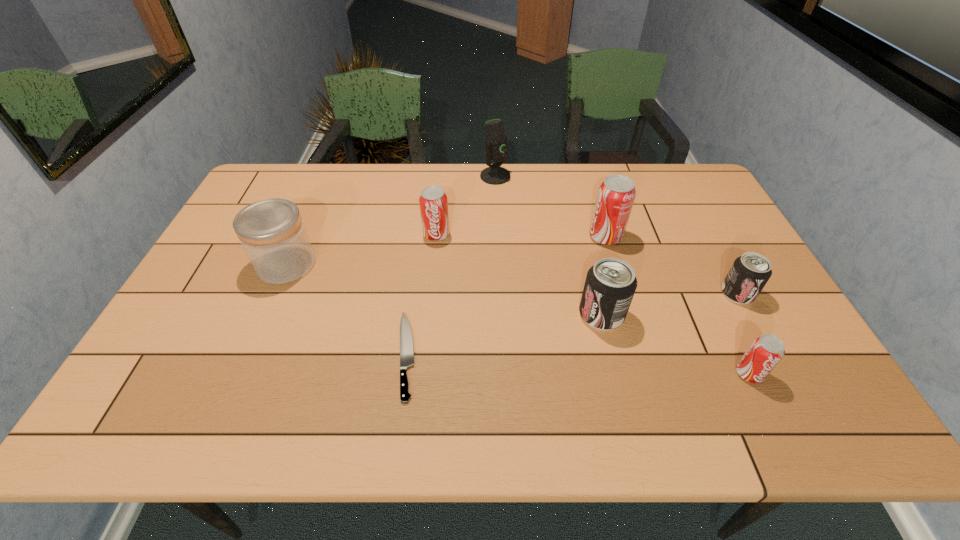
In order to click on the nearest red soda can in this screenshot , I will do `click(766, 351)`.

Locate an element on the screen. The image size is (960, 540). steak knife is located at coordinates (406, 341).

The width and height of the screenshot is (960, 540). Find the location of `vacant space located on the front of the farthest object`. vacant space located on the front of the farthest object is located at coordinates (496, 208).

Locate an element on the screen. The height and width of the screenshot is (540, 960). vacant space positioned 0.280m on the logo side of the tallest soda can is located at coordinates (496, 237).

The image size is (960, 540). Find the location of `blank space located 0.100m on the logo side of the tallest soda can`. blank space located 0.100m on the logo side of the tallest soda can is located at coordinates (556, 237).

Find the location of a particular element. This screenshot has width=960, height=540. free spot located on the logo side of the tallest soda can is located at coordinates (526, 237).

Locate an element on the screen. The height and width of the screenshot is (540, 960). vacant region located 0.260m on the right of the leftmost object is located at coordinates click(x=406, y=265).

Locate an element on the screen. vacant region located on the logo side of the leftmost soda can is located at coordinates (428, 316).

At what (x,y) coordinates should I click in order to perform the action: click on free space located 0.260m on the back of the left black soda can. Please return your answer as a coordinate pair (x, y). Looking at the image, I should click on (582, 234).

Find the location of a particular element. The image size is (960, 540). vacant space located 0.190m on the left of the smaller black soda can is located at coordinates (650, 293).